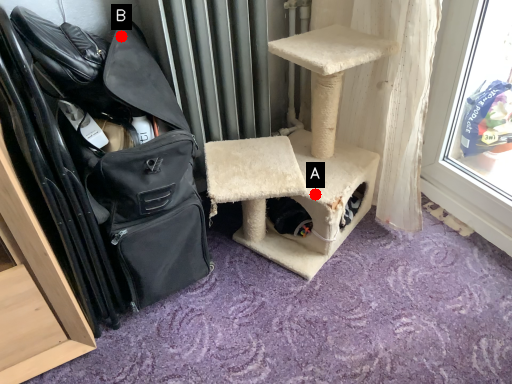
Question: Two points are circled on the image, labeled by A and B beside each circle. Among these points, which one is nearest to the camera?

Choices:
 (A) A is closer
 (B) B is closer

Answer: (B)